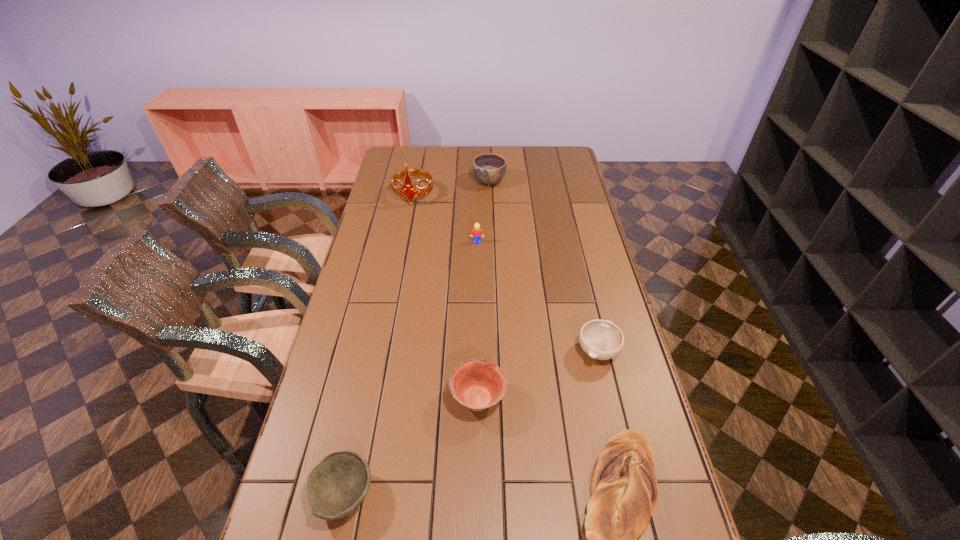
I want to click on tiara, so click(x=409, y=191).

You are a GUI agent. You are given a task and a screenshot of the screen. Output one action in this format:
    pyautogui.click(x=<x>, y=<y>)
    Task: Click on the farthest bowl
    This screenshot has height=540, width=960.
    Given the screenshot: What is the action you would take?
    pyautogui.click(x=489, y=169)

This screenshot has height=540, width=960. What are the coordinates of `the tallest bowl` in the screenshot? It's located at (489, 169).

Image resolution: width=960 pixels, height=540 pixels. I want to click on the third farthest object, so click(476, 233).

In order to click on the fifth farthest object in this screenshot , I will do [x=477, y=384].

Locate an element on the screen. This screenshot has height=540, width=960. the rightmost bowl is located at coordinates (600, 339).

Locate an element on the screen. the third nearest bowl is located at coordinates (600, 339).

This screenshot has width=960, height=540. I want to click on the nearest bowl, so click(335, 487).

This screenshot has width=960, height=540. I want to click on vacant space located on the front-facing side of the tallest object, so click(405, 235).

You are a GUI agent. You are given a task and a screenshot of the screen. Output one action in this format:
    pyautogui.click(x=<x>, y=<y>)
    Task: Click on the vacant area situated on the right of the second tallest object
    This screenshot has height=540, width=960.
    Given the screenshot: What is the action you would take?
    pyautogui.click(x=540, y=181)